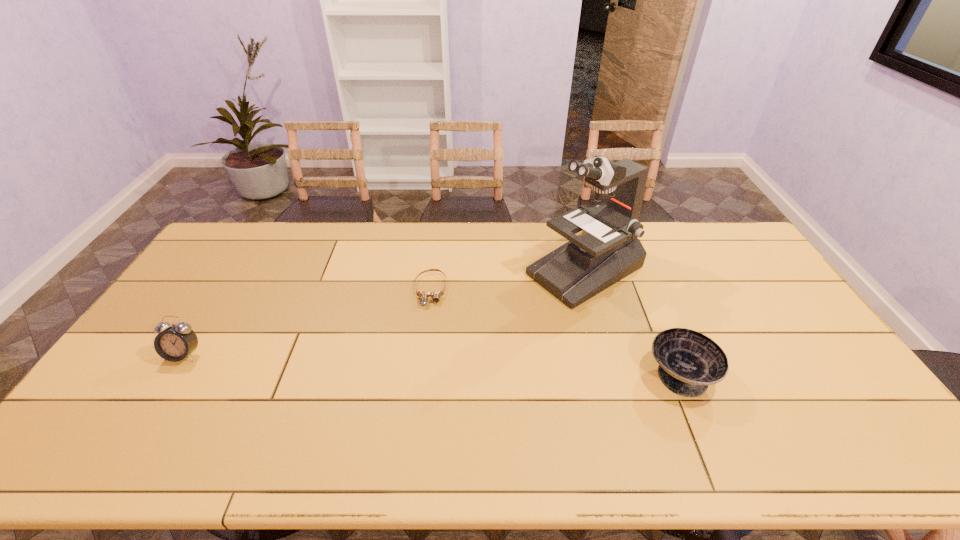
At what (x,y) coordinates should I click in order to perform the action: click on free space on the desktop that is between the second tallest object and the bowl and is positioned through the eyepieces of the tallest object. Please return your answer as a coordinate pair (x, y). The width and height of the screenshot is (960, 540). Looking at the image, I should click on (417, 364).

Locate an element on the screen. This screenshot has height=540, width=960. vacant space on the desktop that is between the alarm clock and the bowl and is positioned on the front lenses and sides of the goggles is located at coordinates (426, 364).